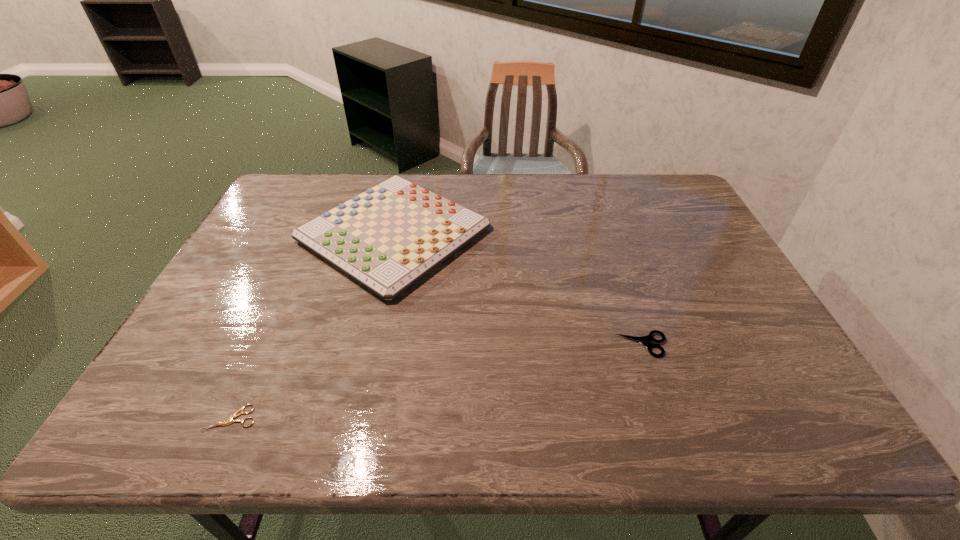
Locate an element on the screen. The width and height of the screenshot is (960, 540). vacant space that is in between the shortest object and the second tallest object is located at coordinates (437, 381).

Where is `vacant region between the right shears and the left shears`? vacant region between the right shears and the left shears is located at coordinates (437, 381).

The image size is (960, 540). What are the coordinates of `free spot between the rightmost object and the nearest object` in the screenshot? It's located at [437, 381].

This screenshot has height=540, width=960. I want to click on empty space that is in between the farthest object and the nearer shears, so click(x=313, y=326).

You are a GUI agent. You are given a task and a screenshot of the screen. Output one action in this format:
    pyautogui.click(x=<x>, y=<y>)
    Task: Click on the vacant area that lies between the rightmost object and the nearest object
    This screenshot has height=540, width=960.
    Given the screenshot: What is the action you would take?
    pyautogui.click(x=437, y=381)

Locate an element on the screen. Image resolution: width=960 pixels, height=540 pixels. vacant point located between the second tallest object and the shorter shears is located at coordinates (437, 381).

Locate an element on the screen. The height and width of the screenshot is (540, 960). vacant space that is in between the rightmost object and the shortest object is located at coordinates (437, 381).

The width and height of the screenshot is (960, 540). Find the location of `free area in between the shortest object and the farthest object`. free area in between the shortest object and the farthest object is located at coordinates (313, 326).

Find the location of a particular element. The width and height of the screenshot is (960, 540). free space between the farthest object and the farther shears is located at coordinates (518, 289).

Image resolution: width=960 pixels, height=540 pixels. Find the location of `the second closest object to the farther shears`. the second closest object to the farther shears is located at coordinates click(235, 415).